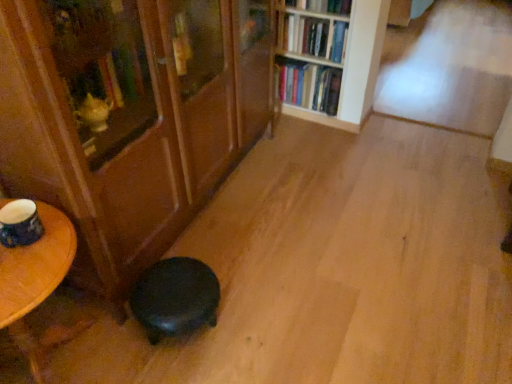
Question: Does hardcover books at upper center, which appears as the 1th book when ordered from the bottom, appear on the left side of wooden bookshelf at upper center, which appears as the first bookcase when viewed from the right?

Choices:
 (A) no
 (B) yes

Answer: (B)

Question: Considering the relative sizes of hardcover books at upper center, which appears as the 1th book when ordered from the bottom, and wooden bookshelf at upper center, the second bookcase positioned from the left, in the image provided, is hardcover books at upper center, which appears as the 1th book when ordered from the bottom, smaller than wooden bookshelf at upper center, the second bookcase positioned from the left,?

Choices:
 (A) no
 (B) yes

Answer: (B)

Question: Is wooden bookshelf at upper center, which appears as the first bookcase when viewed from the right, a part of hardcover books at upper center, the third book viewed from the top?

Choices:
 (A) no
 (B) yes

Answer: (B)

Question: Can we say hardcover books at upper center, the third book viewed from the top, lies outside wooden bookshelf at upper center, which appears as the first bookcase when viewed from the right?

Choices:
 (A) yes
 (B) no

Answer: (B)

Question: From a real-world perspective, is hardcover books at upper center, the third book viewed from the top, over wooden bookshelf at upper center, which appears as the first bookcase when viewed from the right?

Choices:
 (A) yes
 (B) no

Answer: (B)

Question: From a real-world perspective, is hardcover book at upper center, marked as the 1th book in a top-to-bottom arrangement, above or below wooden bookshelf at upper center, which appears as the first bookcase when viewed from the right?

Choices:
 (A) above
 (B) below

Answer: (A)

Question: Visually, is hardcover book at upper center, which is counted as the third book, starting from the bottom, positioned to the left or to the right of wooden bookshelf at upper center, the second bookcase positioned from the left?

Choices:
 (A) right
 (B) left

Answer: (B)

Question: Is hardcover book at upper center, marked as the 1th book in a top-to-bottom arrangement, bigger or smaller than wooden bookshelf at upper center, which appears as the first bookcase when viewed from the right?

Choices:
 (A) small
 (B) big

Answer: (A)

Question: Considering their positions, is hardcover book at upper center, which is counted as the third book, starting from the bottom, located in front of or behind wooden bookshelf at upper center, which appears as the first bookcase when viewed from the right?

Choices:
 (A) behind
 (B) front

Answer: (A)

Question: In terms of height, does hardcover books at upper center, the third book viewed from the top, look taller or shorter compared to hardcover book at upper center, marked as the 1th book in a top-to-bottom arrangement?

Choices:
 (A) tall
 (B) short

Answer: (A)

Question: Which is correct: hardcover books at upper center, the third book viewed from the top, is inside hardcover book at upper center, marked as the 1th book in a top-to-bottom arrangement, or outside of it?

Choices:
 (A) inside
 (B) outside

Answer: (B)

Question: From a real-world perspective, relative to hardcover book at upper center, which is counted as the third book, starting from the bottom, is hardcover books at upper center, the third book viewed from the top, vertically above or below?

Choices:
 (A) above
 (B) below

Answer: (B)

Question: In the image, is hardcover books at upper center, the third book viewed from the top, positioned in front of or behind hardcover book at upper center, marked as the 1th book in a top-to-bottom arrangement?

Choices:
 (A) front
 (B) behind

Answer: (B)

Question: Based on their sizes in the image, would you say hardcover books at upper center, which ranks as the second book in bottom-to-top order, is bigger or smaller than hardcover book at upper center, which is counted as the third book, starting from the bottom?

Choices:
 (A) small
 (B) big

Answer: (B)

Question: From their relative heights in the image, would you say hardcover books at upper center, which ranks as the second book in bottom-to-top order, is taller or shorter than hardcover book at upper center, which is counted as the third book, starting from the bottom?

Choices:
 (A) tall
 (B) short

Answer: (A)